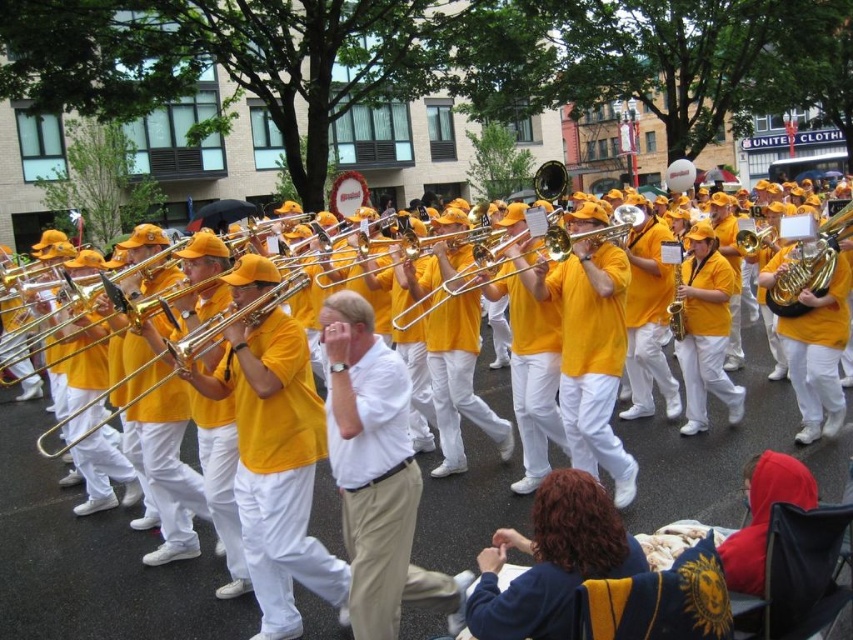
Question: Which object appears farthest from the camera in this image?

Choices:
 (A) gold shiny trumpet at center
 (B) dark blue fleece at lower center
 (C) gold brass trumpet at center-right

Answer: (A)

Question: Is matte yellow trombone at center to the right of dark blue fleece at lower center from the viewer's perspective?

Choices:
 (A) no
 (B) yes

Answer: (A)

Question: Which point is closer to the camera?

Choices:
 (A) gold shiny trumpet at center
 (B) gold brass trumpet at center-right
 (C) dark blue fleece at lower center
 (D) white cotton shirt at center

Answer: (C)

Question: Which point appears closest to the camera in this image?

Choices:
 (A) (387, 561)
 (B) (479, 484)
 (C) (843, 220)
 (D) (741, 241)

Answer: (A)

Question: Can you confirm if white cotton shirt at center is positioned to the left of gold brass trumpet at center-right?

Choices:
 (A) no
 (B) yes

Answer: (B)

Question: Is matte yellow trombone at center closer to the viewer compared to white cotton shirt at center?

Choices:
 (A) yes
 (B) no

Answer: (A)